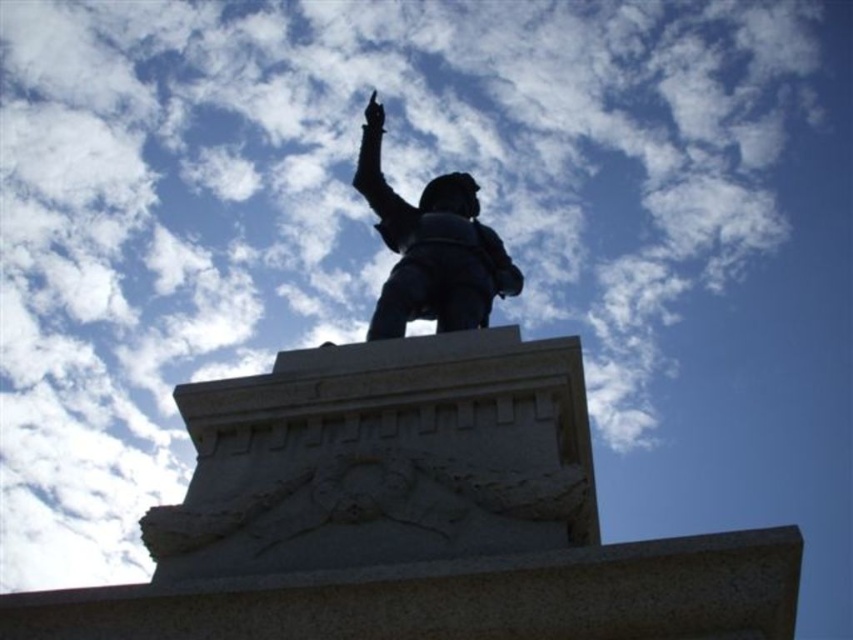
Can you confirm if black metal statue at center is positioned above bronze statue at center?

Incorrect, black metal statue at center is not positioned above bronze statue at center.

Looking at this image, measure the distance between point (430, 400) and camera.

51.47 meters

Identify the location of black metal statue at center. (392, 420).